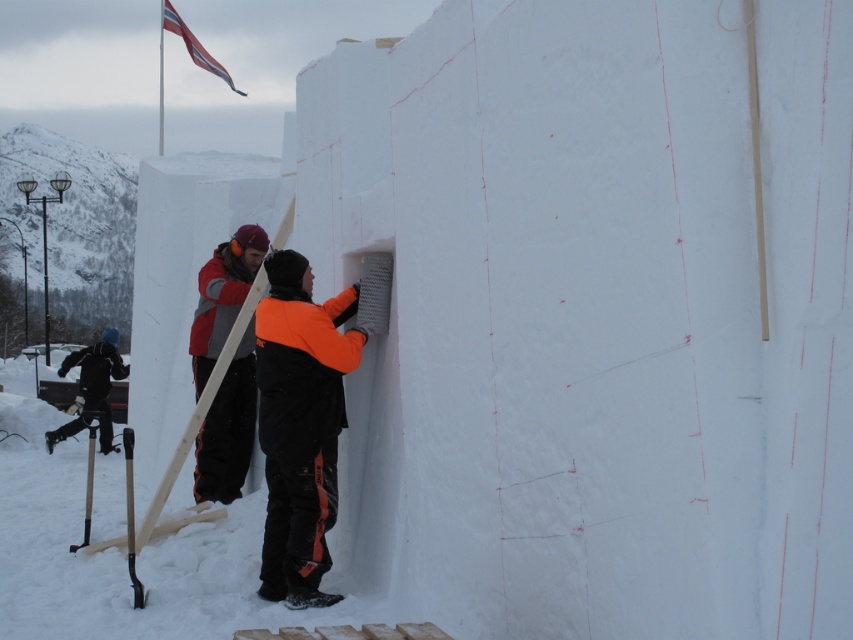
Locate an element on the screen. orange fleece jacket at center is located at coordinates (300, 422).

Is point (318, 476) positioned behind point (112, 337)?

No, it is not.

Is point (265, 262) closer to viewer compared to point (67, 362)?

Yes, it is in front of point (67, 362).

At what (x,y) coordinates should I click in order to perform the action: click on orange fleece jacket at center. Please return your answer as a coordinate pair (x, y). The width and height of the screenshot is (853, 640). Looking at the image, I should click on (300, 422).

Which is above, orange fleece jacket at center or red jacket at center?

red jacket at center

Between orange fleece jacket at center and red jacket at center, which one has less height?

With less height is orange fleece jacket at center.

Which is behind, point (311, 488) or point (212, 333)?

The point (212, 333) is behind.

The width and height of the screenshot is (853, 640). Identify the location of orange fleece jacket at center. (300, 422).

Is black snowsuit at lower left wider than red fabric flag at upper left?

No, black snowsuit at lower left is not wider than red fabric flag at upper left.

Does black snowsuit at lower left appear over red fabric flag at upper left?

No, black snowsuit at lower left is not above red fabric flag at upper left.

Find the location of `black snowsuit at lower left`. black snowsuit at lower left is located at coordinates (91, 388).